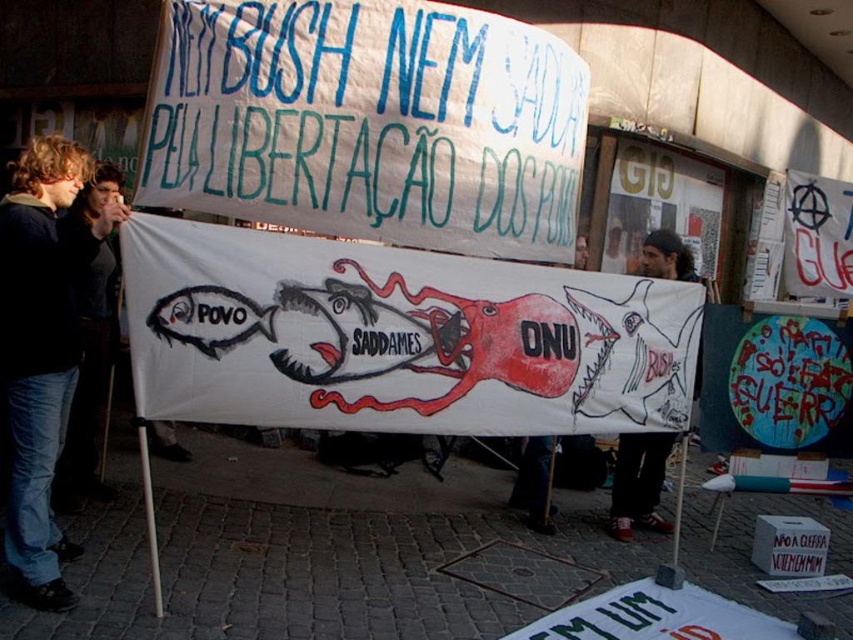
Question: Which object is farther from the camera taking this photo?

Choices:
 (A) dark gray knit cap at upper center
 (B) white paper banner at center
 (C) white paper banner at upper center
 (D) jeans at left

Answer: (A)

Question: Can you confirm if white paper banner at center is positioned above dark gray knit cap at upper center?

Choices:
 (A) no
 (B) yes

Answer: (B)

Question: Is white paper banner at center above dark gray knit cap at upper center?

Choices:
 (A) yes
 (B) no

Answer: (A)

Question: Is the position of white paper banner at upper center more distant than that of dark gray knit cap at upper center?

Choices:
 (A) no
 (B) yes

Answer: (A)

Question: Which is farther from the white paper banner at upper center?

Choices:
 (A) dark gray knit cap at upper center
 (B) jeans at left
 (C) white paper banner at center

Answer: (A)

Question: Which object is the closest to the dark gray knit cap at upper center?

Choices:
 (A) white paper banner at upper center
 (B) jeans at left

Answer: (A)